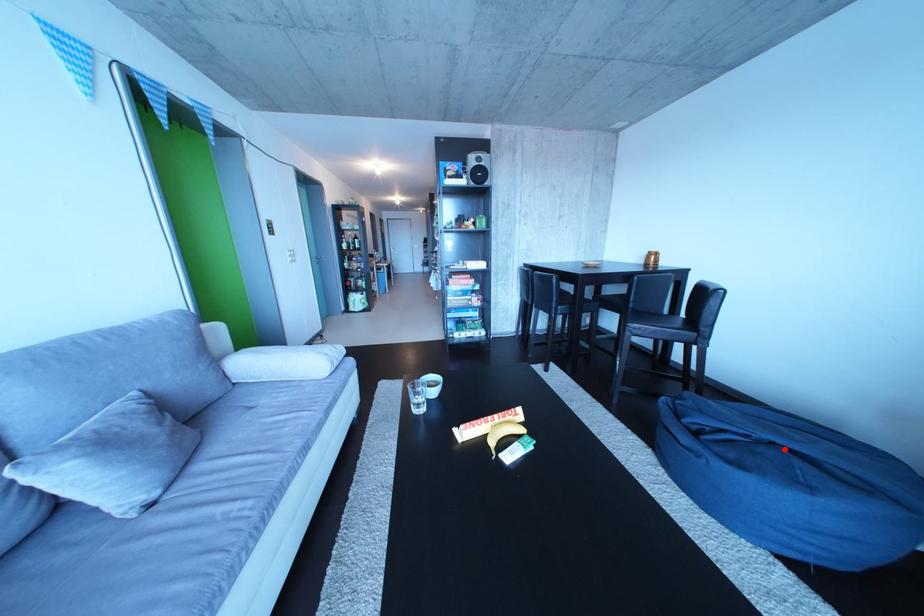
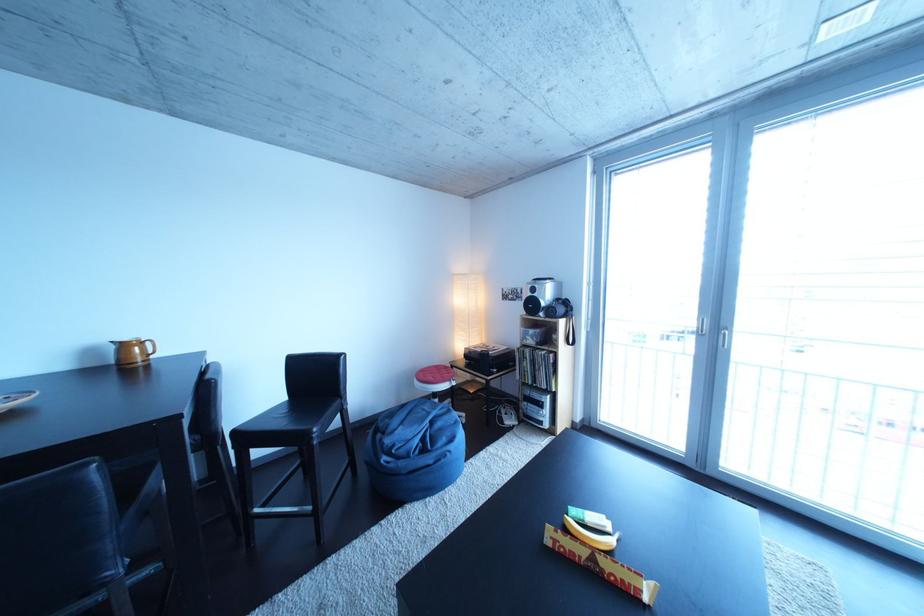
In the second image, find the point that corresponds to the highlighted location in the first image.

(444, 428)